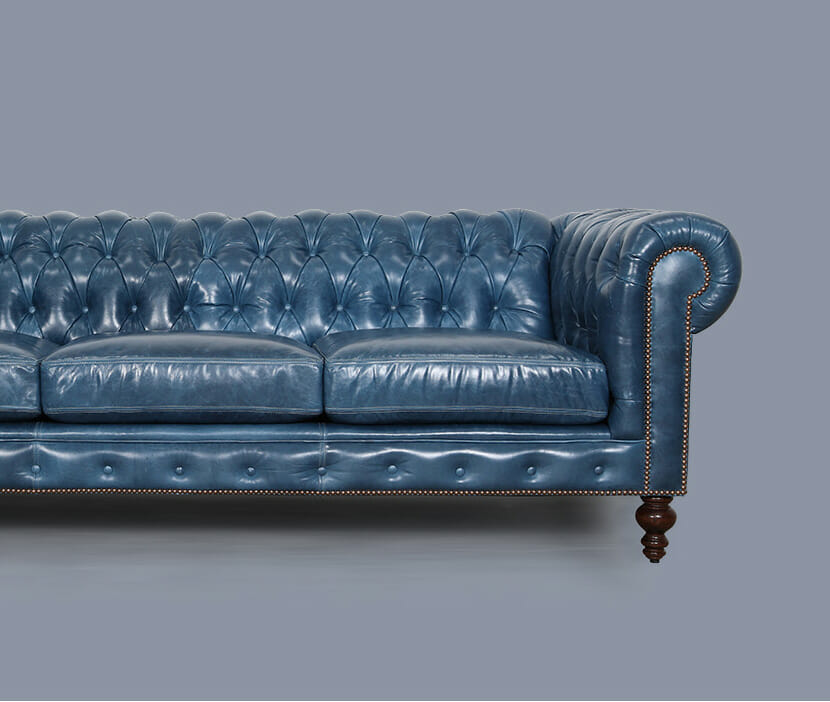
At what (x,y) coordinates should I click in order to perform the action: click on reflection off arm of couch. Please return your answer as a coordinate pair (x, y). This screenshot has height=702, width=830. Looking at the image, I should click on (x=657, y=263).